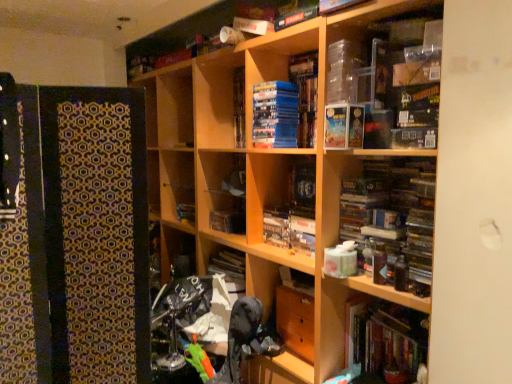
Find the location of `hardcover book at center, which is counted as the 2th paperback book, starting from the left`. hardcover book at center, which is counted as the 2th paperback book, starting from the left is located at coordinates (344, 126).

What do you see at coordinates (389, 340) in the screenshot? I see `hardcover books at lower right, which is counted as the 1th book, starting from the right` at bounding box center [389, 340].

Locate an element on the screen. The width and height of the screenshot is (512, 384). wooden bookcase at center is located at coordinates click(x=310, y=187).

The height and width of the screenshot is (384, 512). Describe the element at coordinates (275, 115) in the screenshot. I see `blue matte stack of books at center, placed as the 2th paperback book when sorted from front to back` at that location.

This screenshot has height=384, width=512. In order to click on hardcover book at center, the 2th book positioned from the right in this screenshot , I will do `click(228, 221)`.

Measure the distance between hardcover book at center, arranged as the 1th book when viewed from the left, and camera.

7.43 feet.

I want to click on hardcover book at center, marked as the first paperback book in a front-to-back arrangement, so click(x=344, y=126).

Considering the sizes of objects wooden bookcase at center and patterned fabric at left in the image provided, who is wider, wooden bookcase at center or patterned fabric at left?

wooden bookcase at center is wider.

Which is in front, point (297, 167) or point (75, 266)?

Positioned in front is point (75, 266).

Is wooden bookcase at center smaller than patterned fabric at left?

No.

Consider the image. From the image's perspective, between wooden bookcase at center and blue matte stack of books at center, which appears as the first paperback book when viewed from the left, who is located below?

wooden bookcase at center is shown below in the image.

Is wooden bookcase at center positioned before blue matte stack of books at center, the first paperback book positioned from the back?

Yes, it is in front of blue matte stack of books at center, the first paperback book positioned from the back.

Based on the photo, considering the sizes of objects wooden bookcase at center and blue matte stack of books at center, the first paperback book positioned from the back, in the image provided, who is shorter, wooden bookcase at center or blue matte stack of books at center, the first paperback book positioned from the back,?

blue matte stack of books at center, the first paperback book positioned from the back, is shorter.

Based on the photo, is wooden bookcase at center to the right of blue matte stack of books at center, which appears as the first paperback book when viewed from the left, from the viewer's perspective?

No, wooden bookcase at center is not to the right of blue matte stack of books at center, which appears as the first paperback book when viewed from the left.

Considering the relative sizes of blue matte stack of books at center, which ranks as the 2th paperback book in right-to-left order, and hardcover books at lower right, which appears as the 2th book when viewed from the top, in the image provided, is blue matte stack of books at center, which ranks as the 2th paperback book in right-to-left order, wider than hardcover books at lower right, which appears as the 2th book when viewed from the top,?

Incorrect, the width of blue matte stack of books at center, which ranks as the 2th paperback book in right-to-left order, does not surpass that of hardcover books at lower right, which appears as the 2th book when viewed from the top.

Does blue matte stack of books at center, which ranks as the 2th paperback book in right-to-left order, turn towards hardcover books at lower right, which is counted as the second book, starting from the back?

No, blue matte stack of books at center, which ranks as the 2th paperback book in right-to-left order, is not oriented towards hardcover books at lower right, which is counted as the second book, starting from the back.

From a real-world perspective, between blue matte stack of books at center, which appears as the first paperback book when viewed from the left, and hardcover books at lower right, which is counted as the 1th book, starting from the right, who is vertically lower?

From a 3D spatial view, hardcover books at lower right, which is counted as the 1th book, starting from the right, is below.

Is blue matte stack of books at center, which ranks as the 2th paperback book in right-to-left order, in front of hardcover books at lower right, which is counted as the first book, starting from the bottom?

No, it is behind hardcover books at lower right, which is counted as the first book, starting from the bottom.

Can you see hardcover book at center, the 1th book positioned from the back, touching blue matte stack of books at center, placed as the 2th paperback book when sorted from front to back?

They are not placed beside each other.

In the scene shown: Is hardcover book at center, the 2th book positioned from the front, facing away from blue matte stack of books at center, the first paperback book positioned from the back?

No.

In the image, is hardcover book at center, arranged as the 1th book when viewed from the left, positioned in front of or behind blue matte stack of books at center, placed as the 2th paperback book when sorted from front to back?

hardcover book at center, arranged as the 1th book when viewed from the left, is positioned farther from the viewer than blue matte stack of books at center, placed as the 2th paperback book when sorted from front to back.

Between hardcover book at center, the 2th book in the bottom-to-top sequence, and blue matte stack of books at center, which ranks as the 2th paperback book in right-to-left order, which one has less height?

Standing shorter between the two is hardcover book at center, the 2th book in the bottom-to-top sequence.

Based on the photo, considering the positions of objects blue matte stack of books at center, the first paperback book positioned from the back, and hardcover book at center, the 2th paperback book from the back, in the image provided, who is behind, blue matte stack of books at center, the first paperback book positioned from the back, or hardcover book at center, the 2th paperback book from the back,?

blue matte stack of books at center, the first paperback book positioned from the back, is further from the camera.

Is blue matte stack of books at center, which ranks as the 2th paperback book in right-to-left order, with hardcover book at center, the 2th paperback book from the back?

blue matte stack of books at center, which ranks as the 2th paperback book in right-to-left order, and hardcover book at center, the 2th paperback book from the back, are not in contact.

Is blue matte stack of books at center, the first paperback book positioned from the back, thinner than hardcover book at center, marked as the first paperback book in a front-to-back arrangement?

Incorrect, the width of blue matte stack of books at center, the first paperback book positioned from the back, is not less than that of hardcover book at center, marked as the first paperback book in a front-to-back arrangement.

From a real-world perspective, which is physically above, blue matte stack of books at center, the first paperback book positioned from the back, or hardcover book at center, the 2th paperback book from the back?

blue matte stack of books at center, the first paperback book positioned from the back, is physically above.

From the image's perspective, is hardcover books at lower right, which is counted as the second book, starting from the back, beneath hardcover book at center, the 2th book positioned from the front?

Indeed, from the image's perspective, hardcover books at lower right, which is counted as the second book, starting from the back, is shown beneath hardcover book at center, the 2th book positioned from the front.

Which is in front, hardcover books at lower right, which appears as the 2th book when viewed from the top, or hardcover book at center, the 2th book positioned from the front?

hardcover books at lower right, which appears as the 2th book when viewed from the top.

Does hardcover books at lower right, which is counted as the second book, starting from the back, have a larger size compared to hardcover book at center, which is the 1th book from top to bottom?

Indeed, hardcover books at lower right, which is counted as the second book, starting from the back, has a larger size compared to hardcover book at center, which is the 1th book from top to bottom.

Between point (352, 316) and point (229, 232), which one is positioned behind?

The point (229, 232) is farther.

How many degrees apart are the facing directions of hardcover book at center, the 2th book positioned from the front, and patterned fabric at left?

76.9 degrees.

Would you say hardcover book at center, the 1th book positioned from the back, is outside patterned fabric at left?

Yes, hardcover book at center, the 1th book positioned from the back, is outside of patterned fabric at left.

From a real-world perspective, is hardcover book at center, the 2th book in the bottom-to-top sequence, on patterned fabric at left?

Indeed, from a real-world perspective, hardcover book at center, the 2th book in the bottom-to-top sequence, stands above patterned fabric at left.

Is hardcover book at center, which is the 1th book from top to bottom, positioned before patterned fabric at left?

No, it is not.

In the image, there is a patterned fabric at left. What are the coordinates of `bookcase below it (from the image's perspective)` in the screenshot? It's located at (310, 187).

Where is `bookcase in front of the blue matte stack of books at center, which appears as the first paperback book when viewed from the left`? bookcase in front of the blue matte stack of books at center, which appears as the first paperback book when viewed from the left is located at coordinates (310, 187).

Looking at the image, which one is located closer to hardcover books at lower right, the 1th book positioned from the front, hardcover book at center, marked as the first paperback book in a right-to-left arrangement, or patterned fabric at left?

hardcover book at center, marked as the first paperback book in a right-to-left arrangement.

In the scene shown: Estimate the real-world distances between objects in this image. Which object is closer to hardcover books at lower right, which is counted as the first book, starting from the bottom, patterned fabric at left or wooden bookcase at center?

wooden bookcase at center lies closer to hardcover books at lower right, which is counted as the first book, starting from the bottom, than the other object.

Which object lies further to the anchor point blue matte stack of books at center, which appears as the first paperback book when viewed from the left, hardcover book at center, marked as the first paperback book in a front-to-back arrangement, or hardcover books at lower right, which appears as the 2th book when viewed from the top?

The object further to blue matte stack of books at center, which appears as the first paperback book when viewed from the left, is hardcover books at lower right, which appears as the 2th book when viewed from the top.

Looking at the image, which one is located further to hardcover book at center, the 1th book positioned from the back, wooden bookcase at center or blue matte stack of books at center, which ranks as the 2th paperback book in right-to-left order?

blue matte stack of books at center, which ranks as the 2th paperback book in right-to-left order, is positioned further to the anchor hardcover book at center, the 1th book positioned from the back.

Estimate the real-world distances between objects in this image. Which object is closer to hardcover book at center, marked as the first paperback book in a front-to-back arrangement, blue matte stack of books at center, which appears as the first paperback book when viewed from the left, or hardcover books at lower right, which is counted as the 1th book, starting from the right?

blue matte stack of books at center, which appears as the first paperback book when viewed from the left, is positioned closer to the anchor hardcover book at center, marked as the first paperback book in a front-to-back arrangement.

Which object lies further to the anchor point hardcover books at lower right, the 1th book positioned from the front, patterned fabric at left or hardcover book at center, the 2th paperback book from the back?

Among the two, patterned fabric at left is located further to hardcover books at lower right, the 1th book positioned from the front.

Based on their spatial positions, is patterned fabric at left or hardcover book at center, the 2th book in the bottom-to-top sequence, closer to blue matte stack of books at center, which ranks as the 2th paperback book in right-to-left order?

hardcover book at center, the 2th book in the bottom-to-top sequence, is positioned closer to the anchor blue matte stack of books at center, which ranks as the 2th paperback book in right-to-left order.

From the image, which object appears to be nearer to wooden bookcase at center, patterned fabric at left or hardcover book at center, marked as the first paperback book in a right-to-left arrangement?

hardcover book at center, marked as the first paperback book in a right-to-left arrangement, is positioned closer to the anchor wooden bookcase at center.

The height and width of the screenshot is (384, 512). What are the coordinates of `paperback book between patterned fabric at left and hardcover book at center, which is counted as the 2th paperback book, starting from the left, from left to right` in the screenshot? It's located at 275,115.

This screenshot has height=384, width=512. I want to click on bookcase between hardcover book at center, marked as the first paperback book in a right-to-left arrangement, and hardcover books at lower right, marked as the 2th book in a left-to-right arrangement, in the up-down direction, so click(x=310, y=187).

In order to click on cabinet between wooden bookcase at center and hardcover book at center, the 2th book in the bottom-to-top sequence, along the z-axis in this screenshot , I will do `click(74, 236)`.

You are a GUI agent. You are given a task and a screenshot of the screen. Output one action in this format:
    pyautogui.click(x=<x>, y=<y>)
    Task: Click on the paperback book between blue matte stack of books at center, the first paperback book positioned from the back, and wooden bookcase at center in the up-down direction
    
    Given the screenshot: What is the action you would take?
    pyautogui.click(x=344, y=126)